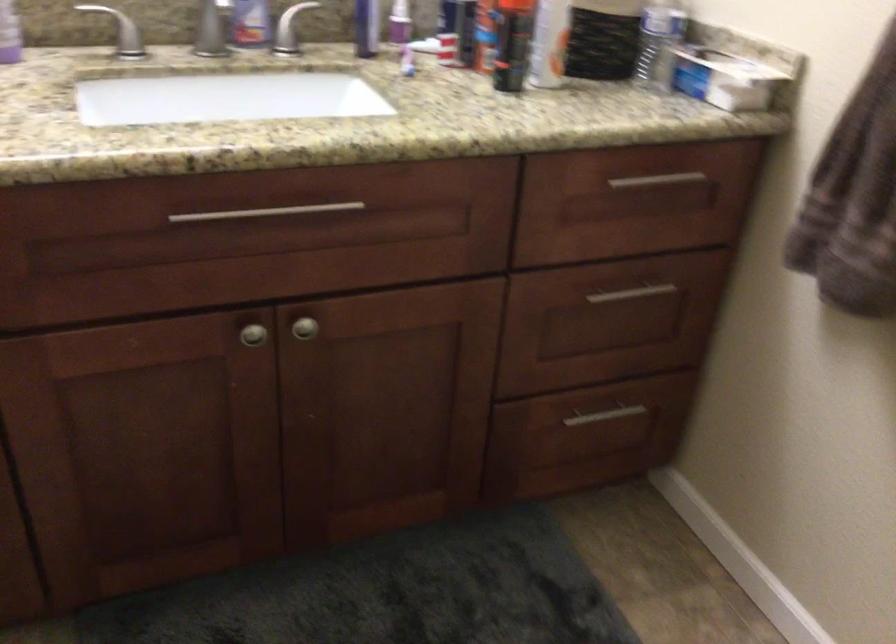
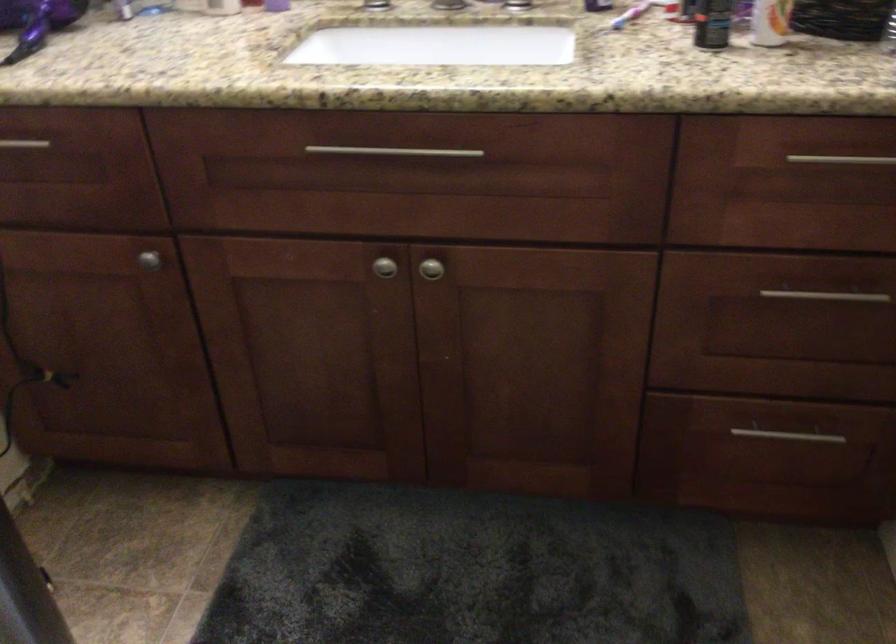
Where in the second image is the point corresponding to (250,334) from the first image?

(383, 267)